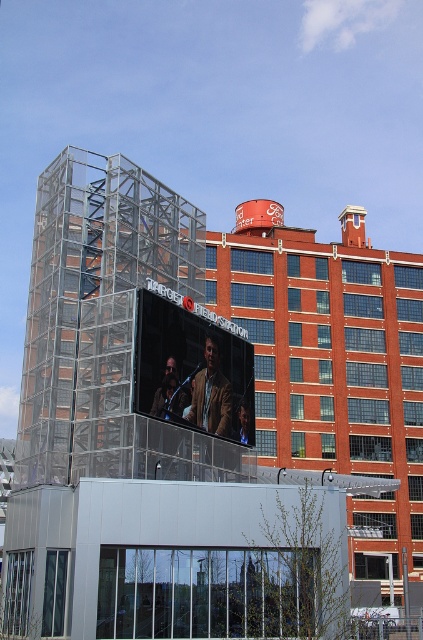
You are a fashion designer observing two jackets displayed on mannequins in the modern glass structure. The jackets are the leather jacket at center and the shiny black jacket at center. Which jacket is positioned to the right of the other?

The leather jacket at center is positioned on the right side of shiny black jacket at center.

You are a photographer standing in front of the glass structure with the large screen showing the live broadcast. You notice two jackets hanging on a rack between you and the screen. Which jacket is closer to you, the leather jacket at center or the shiny black jacket at center?

The leather jacket at center is closer to you because the shiny black jacket at center is behind it.

You are standing in front of the large screen displaying the live broadcast at the modern glass structure. You see two jackets hanging on a rack in front of you. Which jacket is closer to you, the leather jacket at center or the matte brown jacket at center?

The leather jacket at center is closer to the viewer than the matte brown jacket at center.